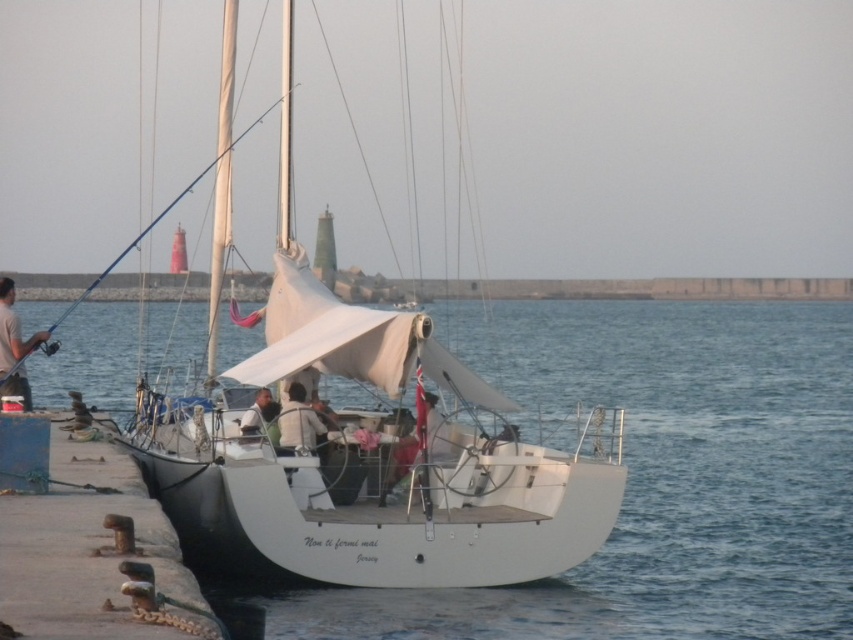
You are a sailor trying to navigate through the white matte water at center and the white matte mast at center. Which one is wider?

The white matte water at center is wider than the white matte mast at center according to the description.